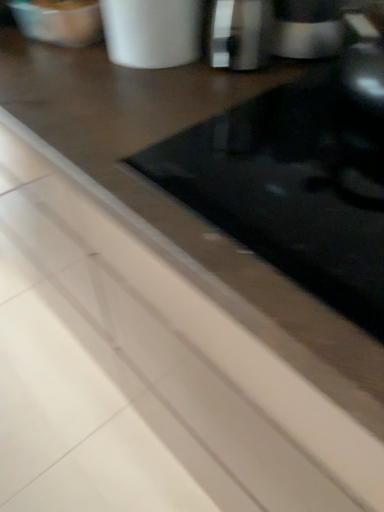
Where is `free space in front of metallic silver cup at upper center`? Image resolution: width=384 pixels, height=512 pixels. free space in front of metallic silver cup at upper center is located at coordinates (149, 99).